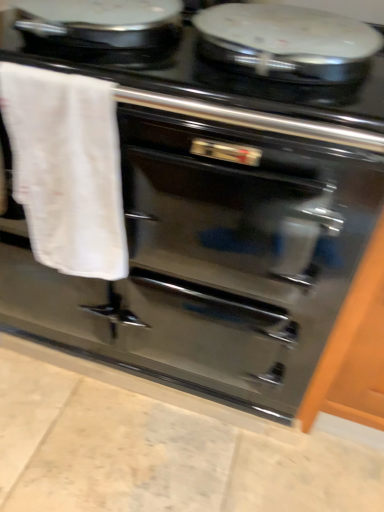
Question: From the image's perspective, is glossy wood cabinet at right located above white cotton towel at left?

Choices:
 (A) yes
 (B) no

Answer: (B)

Question: Could you tell me if glossy wood cabinet at right is turned towards white cotton towel at left?

Choices:
 (A) no
 (B) yes

Answer: (A)

Question: From a real-world perspective, is glossy wood cabinet at right positioned over white cotton towel at left based on gravity?

Choices:
 (A) yes
 (B) no

Answer: (B)

Question: Is white cotton towel at left at the back of glossy wood cabinet at right?

Choices:
 (A) yes
 (B) no

Answer: (B)

Question: Can you confirm if glossy wood cabinet at right is taller than white cotton towel at left?

Choices:
 (A) no
 (B) yes

Answer: (B)

Question: From the image's perspective, is white cotton towel at left located above or below black glossy stove at upper center?

Choices:
 (A) above
 (B) below

Answer: (B)

Question: Relative to black glossy stove at upper center, is white cotton towel at left in front or behind?

Choices:
 (A) front
 (B) behind

Answer: (A)

Question: Is white cotton towel at left to the left or to the right of black glossy stove at upper center in the image?

Choices:
 (A) right
 (B) left

Answer: (B)

Question: From their relative heights in the image, would you say white cotton towel at left is taller or shorter than black glossy stove at upper center?

Choices:
 (A) short
 (B) tall

Answer: (B)

Question: Relative to glossy wood cabinet at right, is black glossy stove at upper center in front or behind?

Choices:
 (A) front
 (B) behind

Answer: (A)

Question: Is black glossy stove at upper center spatially inside glossy wood cabinet at right, or outside of it?

Choices:
 (A) outside
 (B) inside

Answer: (A)

Question: In terms of width, does black glossy stove at upper center look wider or thinner when compared to glossy wood cabinet at right?

Choices:
 (A) thin
 (B) wide

Answer: (A)

Question: Is point (8, 36) closer or farther from the camera than point (342, 339)?

Choices:
 (A) closer
 (B) farther

Answer: (A)

Question: Considering the positions of glossy wood cabinet at right and white cotton towel at left in the image, is glossy wood cabinet at right wider or thinner than white cotton towel at left?

Choices:
 (A) wide
 (B) thin

Answer: (A)

Question: From the image's perspective, is glossy wood cabinet at right located above or below white cotton towel at left?

Choices:
 (A) below
 (B) above

Answer: (A)